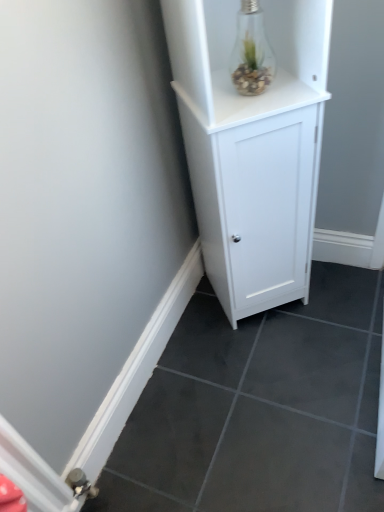
Question: Is white matte cabinet at center taller or shorter than transparent glass light bulb at upper right?

Choices:
 (A) short
 (B) tall

Answer: (B)

Question: In the image, is white matte cabinet at center positioned in front of or behind transparent glass light bulb at upper right?

Choices:
 (A) behind
 (B) front

Answer: (B)

Question: Based on their positions, is white matte cabinet at center located to the left or right of transparent glass light bulb at upper right?

Choices:
 (A) left
 (B) right

Answer: (B)

Question: Choose the correct answer: Is transparent glass light bulb at upper right inside white matte cabinet at center or outside it?

Choices:
 (A) outside
 (B) inside

Answer: (B)

Question: Based on their sizes in the image, would you say transparent glass light bulb at upper right is bigger or smaller than white matte cabinet at center?

Choices:
 (A) small
 (B) big

Answer: (A)

Question: Is transparent glass light bulb at upper right taller or shorter than white matte cabinet at center?

Choices:
 (A) tall
 (B) short

Answer: (B)

Question: From a real-world perspective, is transparent glass light bulb at upper right positioned above or below white matte cabinet at center?

Choices:
 (A) above
 (B) below

Answer: (A)